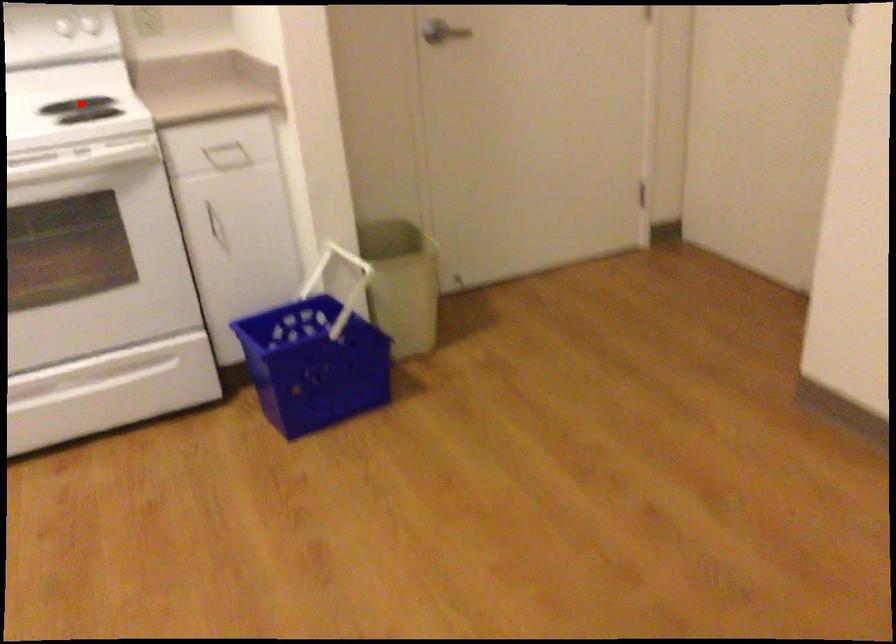
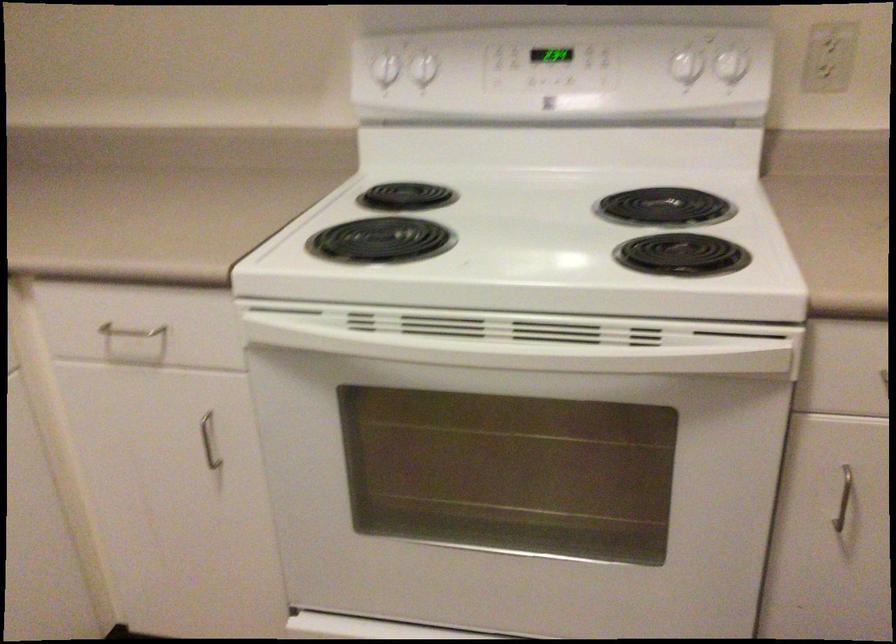
Question: I am providing you with two images of the same scene from different viewpoints. Image1 has a red point marked. In image2, the corresponding 3D location appears at what relative position? Reply with the corresponding letter.

Choices:
 (A) Closer
 (B) Farther

Answer: (A)